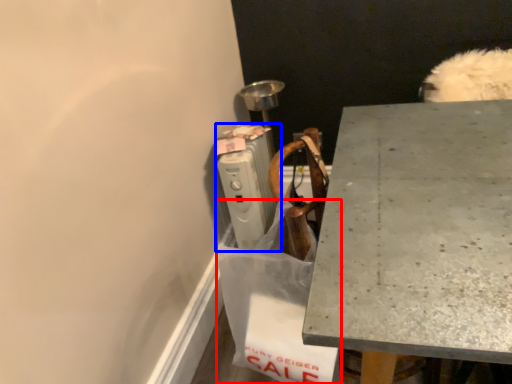
Question: Which point is closer to the camera, shopping bag (highlighted by a red box) or radiator (highlighted by a blue box)?

Choices:
 (A) shopping bag
 (B) radiator

Answer: (A)